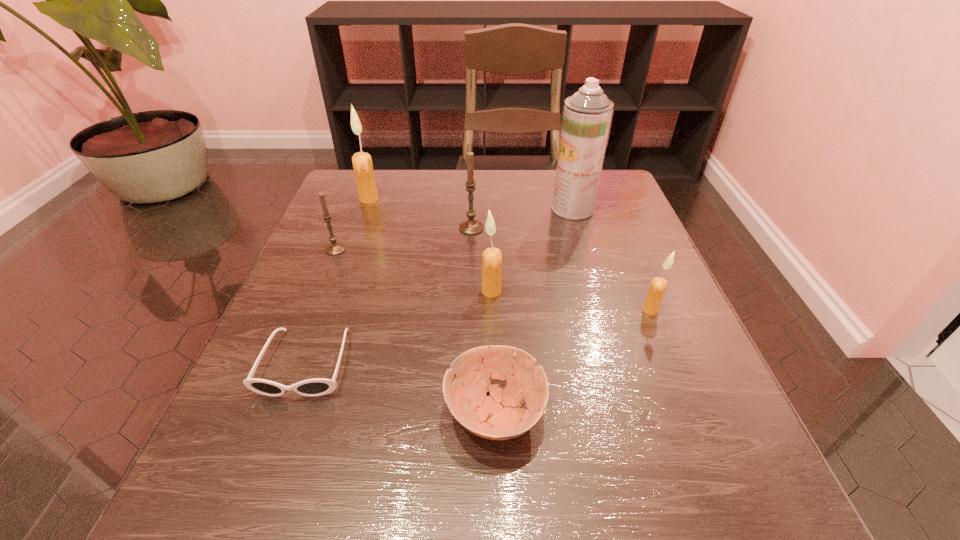
At what (x,y) coordinates should I click in order to perform the action: click on the second object from right to left. Please return your answer as a coordinate pair (x, y). Looking at the image, I should click on (587, 114).

Identify the location of the tallest object. The width and height of the screenshot is (960, 540). (587, 114).

The image size is (960, 540). In order to click on the farthest cream candle in this screenshot , I will do `click(362, 163)`.

Where is `the second tallest object`? The height and width of the screenshot is (540, 960). the second tallest object is located at coordinates (362, 163).

Locate an element on the screen. the right gray candle is located at coordinates (470, 227).

Identify the location of the second farthest candle. This screenshot has width=960, height=540. (470, 227).

Locate an element on the screen. This screenshot has width=960, height=540. the second cream candle from left to right is located at coordinates (492, 259).

Find the location of `the second farthest cream candle`. the second farthest cream candle is located at coordinates (492, 259).

You are a GUI agent. You are given a task and a screenshot of the screen. Output one action in this format:
    pyautogui.click(x=<x>, y=<y>)
    Task: Click on the nearest cream candle
    The height and width of the screenshot is (540, 960).
    Given the screenshot: What is the action you would take?
    pyautogui.click(x=657, y=288)

Identify the location of the rightmost cream candle. (657, 288).